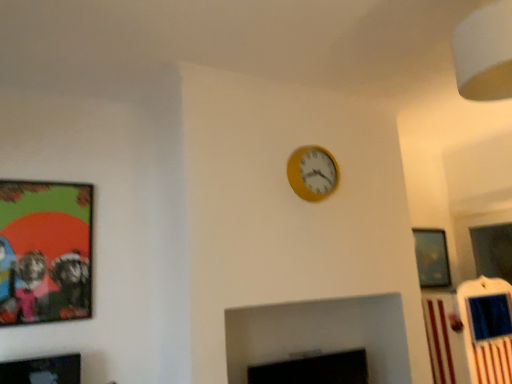
This screenshot has width=512, height=384. What do you see at coordinates (432, 258) in the screenshot?
I see `metallic silver picture frame at upper right, which appears as the third picture frame when viewed from the front` at bounding box center [432, 258].

Locate an element on the screen. metallic silver picture frame at upper right, which is the third picture frame in left-to-right order is located at coordinates (432, 258).

At what (x,y) coordinates should I click in order to perform the action: click on black matte fireplace at lower center. Please return your answer as a coordinate pair (x, y). Looking at the image, I should click on (314, 369).

Where is `yellow matte wall clock at upper center`? yellow matte wall clock at upper center is located at coordinates (312, 173).

Can you confirm if metallic silver picture frame at upper right, which is the third picture frame in left-to-right order, is wider than black matte fireplace at lower center?

No.

Between metallic silver picture frame at upper right, the 1th picture frame viewed from the back, and black matte fireplace at lower center, which one appears on the left side from the viewer's perspective?

Positioned to the left is black matte fireplace at lower center.

How different are the orientations of metallic silver picture frame at upper right, which is the first picture frame from right to left, and black matte fireplace at lower center in degrees?

The angular difference between metallic silver picture frame at upper right, which is the first picture frame from right to left, and black matte fireplace at lower center is 0.00697 degrees.

Can you confirm if metallic silver picture frame at upper right, which is the first picture frame from right to left, is bigger than black matte fireplace at lower center?

Actually, metallic silver picture frame at upper right, which is the first picture frame from right to left, might be smaller than black matte fireplace at lower center.

Find the location of `the 2nd picture frame in front of the yellow matte wall clock at upper center, counting from the anchor's position`. the 2nd picture frame in front of the yellow matte wall clock at upper center, counting from the anchor's position is located at coordinates (42, 370).

Between yellow matte wall clock at upper center and matte black picture frame at lower left, the 2th picture frame when ordered from left to right, which one has larger size?

Bigger between the two is yellow matte wall clock at upper center.

Which is in front, yellow matte wall clock at upper center or matte black picture frame at lower left, the 2th picture frame viewed from the right?

matte black picture frame at lower left, the 2th picture frame viewed from the right, is in front.

Does point (313, 171) come in front of point (65, 371)?

No, (313, 171) is further to viewer.

Considering the sizes of yellow matte wall clock at upper center and metallic silver picture frame at upper right, which is the first picture frame from right to left, in the image, is yellow matte wall clock at upper center wider or thinner than metallic silver picture frame at upper right, which is the first picture frame from right to left,?

In the image, yellow matte wall clock at upper center appears to be wider than metallic silver picture frame at upper right, which is the first picture frame from right to left.

The width and height of the screenshot is (512, 384). Identify the location of wall clock on the left of metallic silver picture frame at upper right, which is the first picture frame from right to left. (312, 173).

Considering the sizes of yellow matte wall clock at upper center and metallic silver picture frame at upper right, which is the third picture frame in left-to-right order, in the image, is yellow matte wall clock at upper center taller or shorter than metallic silver picture frame at upper right, which is the third picture frame in left-to-right order,?

Clearly, yellow matte wall clock at upper center is shorter compared to metallic silver picture frame at upper right, which is the third picture frame in left-to-right order.

In the image, is yellow matte wall clock at upper center positioned in front of or behind metallic silver picture frame at upper right, which is the first picture frame from right to left?

Clearly, yellow matte wall clock at upper center is in front of metallic silver picture frame at upper right, which is the first picture frame from right to left.

Is black matte fireplace at lower center turned away from matte plastic picture frame at left, the second picture frame in the back-to-front sequence?

That's not correct — black matte fireplace at lower center is not looking away from matte plastic picture frame at left, the second picture frame in the back-to-front sequence.

Is matte plastic picture frame at left, the second picture frame when ordered from front to back, a part of black matte fireplace at lower center?

No.

Is black matte fireplace at lower center placed right next to matte plastic picture frame at left, the second picture frame in the back-to-front sequence?

No, black matte fireplace at lower center is not making contact with matte plastic picture frame at left, the second picture frame in the back-to-front sequence.

From a real-world perspective, is black matte fireplace at lower center physically below matte plastic picture frame at left, the second picture frame in the back-to-front sequence?

Yes, from a real-world perspective, black matte fireplace at lower center is below matte plastic picture frame at left, the second picture frame in the back-to-front sequence.

Is matte plastic picture frame at left, placed as the first picture frame when sorted from left to right, spatially inside yellow matte wall clock at upper center, or outside of it?

matte plastic picture frame at left, placed as the first picture frame when sorted from left to right, exists outside the volume of yellow matte wall clock at upper center.

How many degrees apart are the facing directions of matte plastic picture frame at left, which appears as the third picture frame when viewed from the right, and yellow matte wall clock at upper center?

0.00502 degrees.

From a real-world perspective, is matte plastic picture frame at left, the second picture frame in the back-to-front sequence, positioned above or below yellow matte wall clock at upper center?

Clearly, from a real-world perspective, matte plastic picture frame at left, the second picture frame in the back-to-front sequence, is below yellow matte wall clock at upper center.

In the image, there is a matte plastic picture frame at left, which appears as the third picture frame when viewed from the right. In order to click on wall clock above it (from the image's perspective) in this screenshot , I will do `click(312, 173)`.

This screenshot has height=384, width=512. What are the coordinates of `the 1st picture frame directly above the black matte fireplace at lower center (from a real-world perspective)` in the screenshot? It's located at (42, 370).

Does matte black picture frame at lower left, the 2th picture frame when ordered from left to right, come behind black matte fireplace at lower center?

No, it is in front of black matte fireplace at lower center.

Could you measure the distance between matte black picture frame at lower left, arranged as the 3th picture frame when viewed from the back, and black matte fireplace at lower center?

A distance of 4.30 feet exists between matte black picture frame at lower left, arranged as the 3th picture frame when viewed from the back, and black matte fireplace at lower center.

Which of these two, black matte fireplace at lower center or yellow matte wall clock at upper center, is smaller?

With smaller size is yellow matte wall clock at upper center.

Is black matte fireplace at lower center facing towards yellow matte wall clock at upper center?

No, black matte fireplace at lower center is not facing towards yellow matte wall clock at upper center.

Would you say black matte fireplace at lower center is outside yellow matte wall clock at upper center?

Yes, black matte fireplace at lower center is not within yellow matte wall clock at upper center.

Does black matte fireplace at lower center have a greater height compared to yellow matte wall clock at upper center?

In fact, black matte fireplace at lower center may be shorter than yellow matte wall clock at upper center.

Locate an element on the screen. This screenshot has width=512, height=384. fireplace directly beneath the metallic silver picture frame at upper right, which appears as the third picture frame when viewed from the front (from a real-world perspective) is located at coordinates (314, 369).

The width and height of the screenshot is (512, 384). Find the location of `wall clock behind the matte black picture frame at lower left, arranged as the first picture frame when viewed from the front`. wall clock behind the matte black picture frame at lower left, arranged as the first picture frame when viewed from the front is located at coordinates (312, 173).

Based on their spatial positions, is matte plastic picture frame at left, the second picture frame when ordered from front to back, or metallic silver picture frame at upper right, the 1th picture frame viewed from the back, closer to yellow matte wall clock at upper center?

Among the two, matte plastic picture frame at left, the second picture frame when ordered from front to back, is located nearer to yellow matte wall clock at upper center.

Considering their positions, is black matte fireplace at lower center positioned further to metallic silver picture frame at upper right, which is the third picture frame in left-to-right order, than yellow matte wall clock at upper center?

Based on the image, yellow matte wall clock at upper center appears to be further to metallic silver picture frame at upper right, which is the third picture frame in left-to-right order.

When comparing their distances from metallic silver picture frame at upper right, which is the first picture frame from right to left, does yellow matte wall clock at upper center or matte black picture frame at lower left, arranged as the 3th picture frame when viewed from the back, seem closer?

Among the two, yellow matte wall clock at upper center is located nearer to metallic silver picture frame at upper right, which is the first picture frame from right to left.

When comparing their distances from matte black picture frame at lower left, the 2th picture frame viewed from the right, does yellow matte wall clock at upper center or black matte fireplace at lower center seem further?

Among the two, yellow matte wall clock at upper center is located further to matte black picture frame at lower left, the 2th picture frame viewed from the right.

Looking at the image, which one is located closer to matte plastic picture frame at left, the second picture frame when ordered from front to back, metallic silver picture frame at upper right, which is the first picture frame from right to left, or yellow matte wall clock at upper center?

yellow matte wall clock at upper center is closer to matte plastic picture frame at left, the second picture frame when ordered from front to back.

From the image, which object appears to be farther from matte black picture frame at lower left, arranged as the first picture frame when viewed from the front, yellow matte wall clock at upper center or metallic silver picture frame at upper right, the 1th picture frame viewed from the back?

metallic silver picture frame at upper right, the 1th picture frame viewed from the back, is further to matte black picture frame at lower left, arranged as the first picture frame when viewed from the front.

Looking at this image, estimate the real-world distances between objects in this image. Which object is closer to black matte fireplace at lower center, matte plastic picture frame at left, the second picture frame when ordered from front to back, or yellow matte wall clock at upper center?

The object closer to black matte fireplace at lower center is yellow matte wall clock at upper center.

Looking at this image, estimate the real-world distances between objects in this image. Which object is further from black matte fireplace at lower center, matte black picture frame at lower left, the 2th picture frame viewed from the right, or matte plastic picture frame at left, the second picture frame in the back-to-front sequence?

matte plastic picture frame at left, the second picture frame in the back-to-front sequence, is further to black matte fireplace at lower center.

Find the location of `fireplace situated between matte plastic picture frame at left, the second picture frame when ordered from front to back, and metallic silver picture frame at upper right, which is the third picture frame in left-to-right order, from left to right`. fireplace situated between matte plastic picture frame at left, the second picture frame when ordered from front to back, and metallic silver picture frame at upper right, which is the third picture frame in left-to-right order, from left to right is located at coordinates (314, 369).

Image resolution: width=512 pixels, height=384 pixels. Find the location of `picture frame situated between matte plastic picture frame at left, the second picture frame in the back-to-front sequence, and metallic silver picture frame at upper right, which appears as the third picture frame when viewed from the front, from left to right`. picture frame situated between matte plastic picture frame at left, the second picture frame in the back-to-front sequence, and metallic silver picture frame at upper right, which appears as the third picture frame when viewed from the front, from left to right is located at coordinates (x=42, y=370).

I want to click on fireplace between matte black picture frame at lower left, arranged as the first picture frame when viewed from the front, and metallic silver picture frame at upper right, which is the third picture frame in left-to-right order, in the horizontal direction, so click(314, 369).

Locate an element on the screen. This screenshot has width=512, height=384. wall clock between black matte fireplace at lower center and metallic silver picture frame at upper right, the 1th picture frame viewed from the back, along the z-axis is located at coordinates (312, 173).